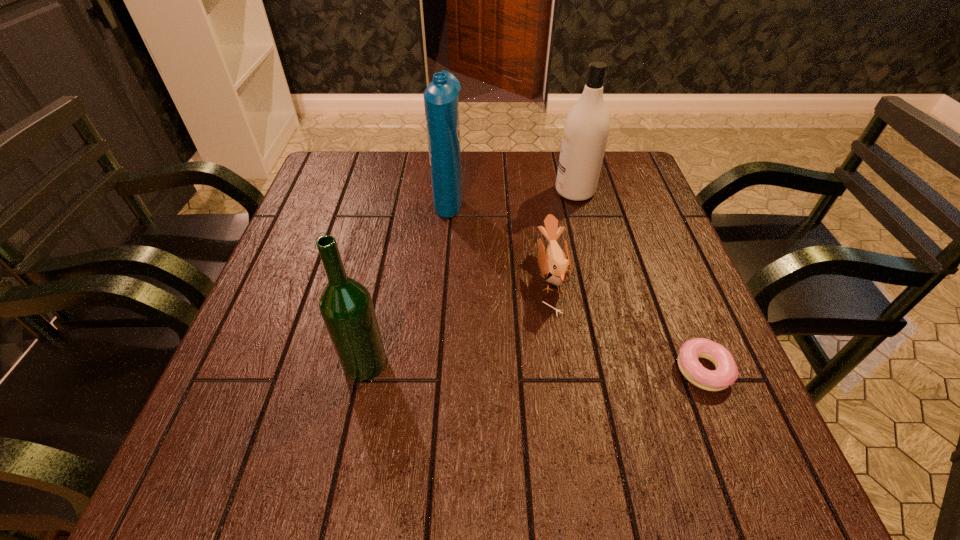
At what (x,y) coordinates should I click in order to perform the action: click on free space at the left edge of the desktop. Please return your answer as a coordinate pair (x, y). The width and height of the screenshot is (960, 540). Looking at the image, I should click on (314, 266).

Locate an element on the screen. This screenshot has width=960, height=540. free space at the right edge is located at coordinates (702, 407).

In the image, there is a desktop. Identify the location of free space at the far left corner. The height and width of the screenshot is (540, 960). (345, 180).

I want to click on free space at the far right corner of the desktop, so click(612, 167).

Find the location of a particular element. free area in between the alcohol and the doughnut is located at coordinates (534, 367).

I want to click on free spot between the fourth object from right to left and the right shampoo, so click(512, 194).

Locate an element on the screen. The height and width of the screenshot is (540, 960). free space between the doughnut and the fourth tallest object is located at coordinates (627, 323).

Identify the location of vacant space in between the second object from right to left and the alcohol. The width and height of the screenshot is (960, 540). (470, 277).

Where is `unoccupied area between the alcohol and the rightmost object`? This screenshot has height=540, width=960. unoccupied area between the alcohol and the rightmost object is located at coordinates (534, 367).

The width and height of the screenshot is (960, 540). What are the coordinates of `free space between the third nearest object and the left shampoo` in the screenshot? It's located at (500, 237).